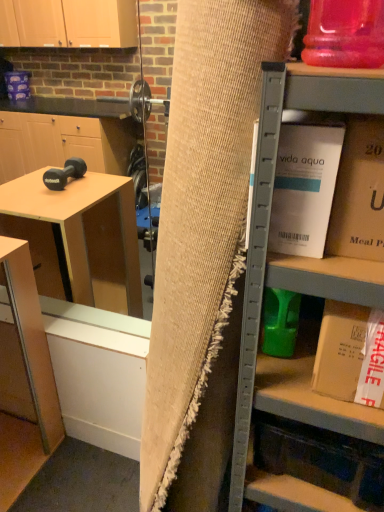
Question: Would you say gold cardboard box at upper right, the 1th book in the top-to-bottom sequence, is part of burlap curtain at center's contents?

Choices:
 (A) yes
 (B) no

Answer: (B)

Question: Is burlap curtain at center located outside gold cardboard box at upper right, the 1th book in the top-to-bottom sequence?

Choices:
 (A) no
 (B) yes

Answer: (B)

Question: Considering the relative sizes of burlap curtain at center and gold cardboard box at upper right, the 1th book in the top-to-bottom sequence, in the image provided, is burlap curtain at center shorter than gold cardboard box at upper right, the 1th book in the top-to-bottom sequence,?

Choices:
 (A) no
 (B) yes

Answer: (A)

Question: Could you tell me if burlap curtain at center is facing gold cardboard box at upper right, the 1th book in the top-to-bottom sequence?

Choices:
 (A) yes
 (B) no

Answer: (B)

Question: Is burlap curtain at center further to camera compared to gold cardboard box at upper right, the 3th book from the bottom?

Choices:
 (A) yes
 (B) no

Answer: (B)

Question: Based on their sizes in the image, would you say burlap curtain at center is bigger or smaller than white cardboard box at right, the 3th book from the top?

Choices:
 (A) big
 (B) small

Answer: (A)

Question: Is point (193, 268) closer or farther from the camera than point (374, 345)?

Choices:
 (A) closer
 (B) farther

Answer: (B)

Question: Is burlap curtain at center situated inside white cardboard box at right, marked as the 1th book in a bottom-to-top arrangement, or outside?

Choices:
 (A) inside
 (B) outside

Answer: (B)

Question: Is burlap curtain at center in front of or behind white cardboard box at right, marked as the 1th book in a bottom-to-top arrangement, in the image?

Choices:
 (A) front
 (B) behind

Answer: (A)

Question: From a real-world perspective, relative to matte wood table at lower left, is burlap curtain at center vertically above or below?

Choices:
 (A) below
 (B) above

Answer: (B)

Question: Considering the positions of burlap curtain at center and matte wood table at lower left in the image, is burlap curtain at center taller or shorter than matte wood table at lower left?

Choices:
 (A) tall
 (B) short

Answer: (A)

Question: Is point click(200, 60) positioned closer to the camera than point click(49, 415)?

Choices:
 (A) farther
 (B) closer

Answer: (B)

Question: Is burlap curtain at center wider or thinner than matte wood table at lower left?

Choices:
 (A) wide
 (B) thin

Answer: (A)

Question: Which is correct: white cardboard box at upper right, which ranks as the 2th book in bottom-to-top order, is inside burlap curtain at center, or outside of it?

Choices:
 (A) inside
 (B) outside

Answer: (B)

Question: Considering the positions of point (322, 227) and point (155, 321), is point (322, 227) closer or farther from the camera than point (155, 321)?

Choices:
 (A) closer
 (B) farther

Answer: (A)